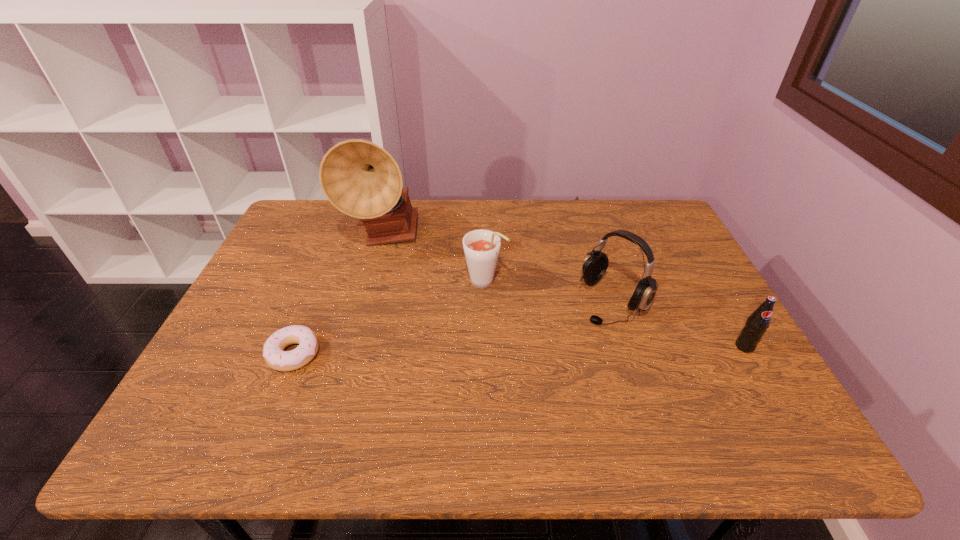
Locate an element on the screen. the shortest object is located at coordinates (275, 357).

The height and width of the screenshot is (540, 960). Find the location of `the rightmost object`. the rightmost object is located at coordinates (758, 322).

Identify the location of pop. This screenshot has width=960, height=540. 758,322.

Where is `phonograph record`? phonograph record is located at coordinates (361, 179).

This screenshot has height=540, width=960. Identify the location of the tallest object. pos(361,179).

The width and height of the screenshot is (960, 540). I want to click on the second object from right to left, so click(595, 264).

The image size is (960, 540). I want to click on root beer, so click(481, 247).

Image resolution: width=960 pixels, height=540 pixels. In order to click on vacant point located on the right of the doughnut in this screenshot , I will do `click(341, 354)`.

Where is `free location located on the front label of the rightmost object`? This screenshot has width=960, height=540. free location located on the front label of the rightmost object is located at coordinates (777, 402).

You are a GUI agent. You are given a task and a screenshot of the screen. Output one action in this format:
    pyautogui.click(x=<x>, y=<y>)
    Task: Click on the vacant area situated 0.130m on the horn of the tallest object
    The width and height of the screenshot is (960, 540).
    Given the screenshot: What is the action you would take?
    pyautogui.click(x=415, y=286)